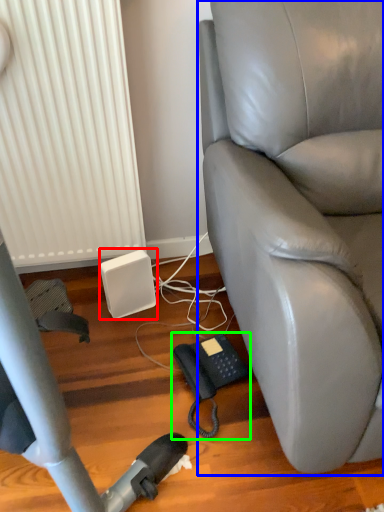
Question: Which is nearer to the speaker (highlighted by a red box)? chair (highlighted by a blue box) or corded phone (highlighted by a green box).

Choices:
 (A) chair
 (B) corded phone

Answer: (B)